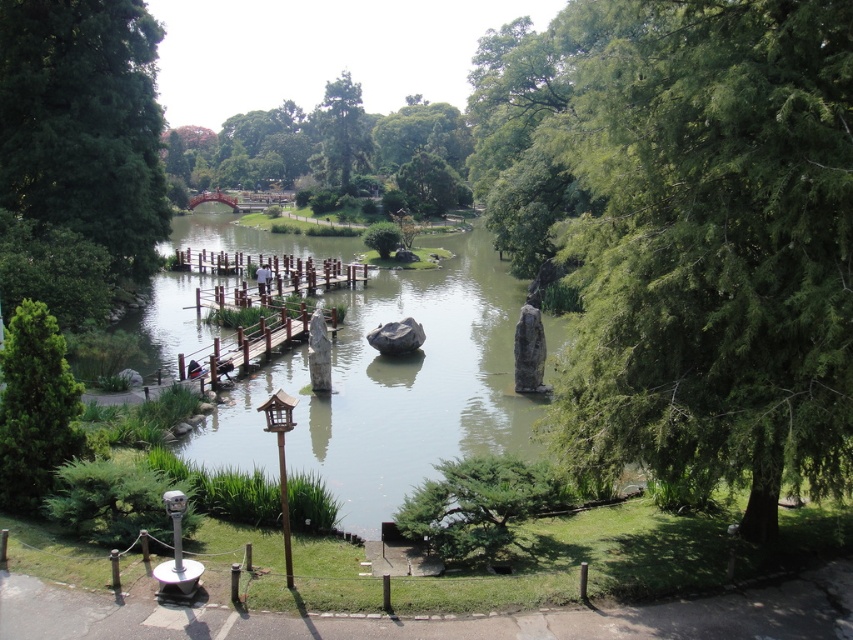
You are standing at the edge of the pond in the Japanese garden and notice a point marked at coordinates (280, 275). According to the scene description, what object is located at that specific coordinate?

The point at coordinates (280, 275) marks the location of the brown wooden dock at center.

You are standing at the wooden bridge in the Japanese garden and want to take a photo of both the green leafy tree at center right and the green leafy tree at lower left. Which tree should you position yourself closer to in order to capture both in a single frame?

You should position yourself closer to the green leafy tree at lower left because the green leafy tree at center right is to the right of the green leafy tree at lower left, so moving closer to the left tree will allow both to be in the frame.

You are standing on the shiny red bridge at center and want to reach the brown wooden dock at center. In which direction should you walk to get there?

You should walk to the right to reach the brown wooden dock at center because it is located to the right of the shiny red bridge at center.